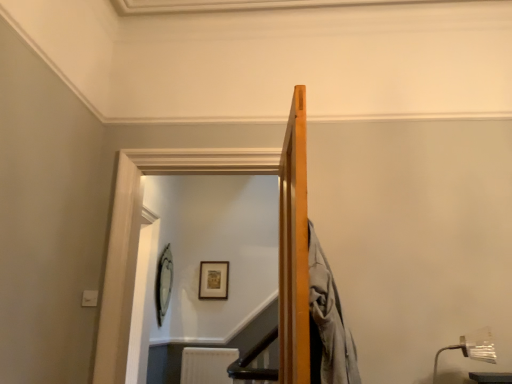
Question: Is clear glass door at upper center with wooden picture frame at upper center, which is counted as the 1th picture frame, starting from the right?

Choices:
 (A) no
 (B) yes

Answer: (A)

Question: Is clear glass door at upper center smaller than wooden picture frame at upper center, which is counted as the 1th picture frame, starting from the right?

Choices:
 (A) yes
 (B) no

Answer: (B)

Question: Does clear glass door at upper center appear on the left side of wooden picture frame at upper center, which ranks as the 2th picture frame in left-to-right order?

Choices:
 (A) yes
 (B) no

Answer: (B)

Question: Does clear glass door at upper center have a lesser width compared to wooden picture frame at upper center, which is counted as the 1th picture frame, starting from the right?

Choices:
 (A) no
 (B) yes

Answer: (A)

Question: Is clear glass door at upper center positioned behind wooden picture frame at upper center, which is counted as the 1th picture frame, starting from the right?

Choices:
 (A) no
 (B) yes

Answer: (A)

Question: Is white textured radiator at lower center to the left or to the right of metallic silver lamp at lower right in the image?

Choices:
 (A) right
 (B) left

Answer: (B)

Question: Based on their sizes in the image, would you say white textured radiator at lower center is bigger or smaller than metallic silver lamp at lower right?

Choices:
 (A) small
 (B) big

Answer: (B)

Question: From their relative heights in the image, would you say white textured radiator at lower center is taller or shorter than metallic silver lamp at lower right?

Choices:
 (A) tall
 (B) short

Answer: (A)

Question: From a real-world perspective, is white textured radiator at lower center physically located above or below metallic silver lamp at lower right?

Choices:
 (A) below
 (B) above

Answer: (A)

Question: Based on their sizes in the image, would you say wooden picture frame at upper center, which is counted as the 1th picture frame, starting from the right, is bigger or smaller than clear glass door at upper center?

Choices:
 (A) big
 (B) small

Answer: (B)

Question: From a real-world perspective, is wooden picture frame at upper center, which ranks as the 2th picture frame in left-to-right order, above or below clear glass door at upper center?

Choices:
 (A) above
 (B) below

Answer: (A)

Question: In terms of width, does wooden picture frame at upper center, which is counted as the 1th picture frame, starting from the right, look wider or thinner when compared to clear glass door at upper center?

Choices:
 (A) thin
 (B) wide

Answer: (A)

Question: Is wooden picture frame at upper center, which is counted as the 1th picture frame, starting from the right, to the left or to the right of clear glass door at upper center in the image?

Choices:
 (A) right
 (B) left

Answer: (B)

Question: Looking at the image, does clear glass door at upper center seem bigger or smaller compared to metallic silver lamp at lower right?

Choices:
 (A) small
 (B) big

Answer: (B)

Question: Relative to metallic silver lamp at lower right, is clear glass door at upper center in front or behind?

Choices:
 (A) behind
 (B) front

Answer: (A)